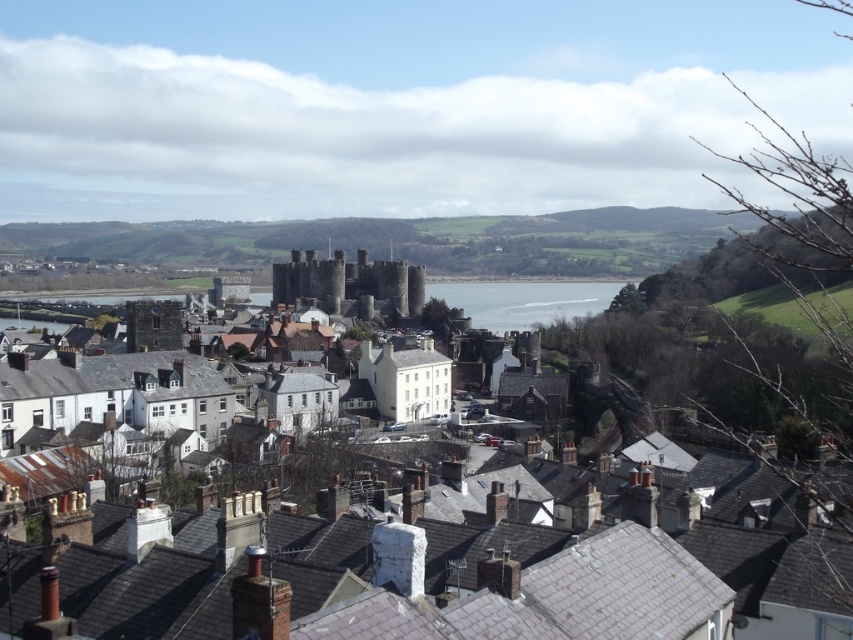
Between point (393, 628) and point (471, 285), which one is positioned behind?

The point (471, 285) is behind.

Is stone castle at center smaller than clear blue water at center?

Yes.

This screenshot has height=640, width=853. Identify the location of stone castle at center. (469, 582).

Where is `stone castle at center`? The height and width of the screenshot is (640, 853). stone castle at center is located at coordinates (469, 582).

Does dark gray stone castle at center have a smaller size compared to clear blue water at center?

Yes, dark gray stone castle at center is smaller than clear blue water at center.

Which is above, dark gray stone castle at center or clear blue water at center?

dark gray stone castle at center

This screenshot has height=640, width=853. What are the coordinates of `dark gray stone castle at center` in the screenshot? It's located at (347, 282).

Looking at this image, can you confirm if stone castle at center is smaller than dark gray stone castle at center?

Correct, stone castle at center occupies less space than dark gray stone castle at center.

What do you see at coordinates (469, 582) in the screenshot?
I see `stone castle at center` at bounding box center [469, 582].

Locate an element on the screen. The height and width of the screenshot is (640, 853). stone castle at center is located at coordinates (469, 582).